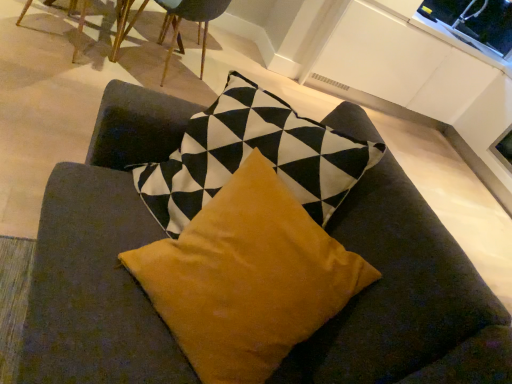
Locate an element on the screen. This screenshot has height=384, width=512. transparent glass window screen at upper right is located at coordinates (503, 148).

The image size is (512, 384). Identify the location of mustard velvet pillow at center. (247, 278).

How much space does wooden chair at upper center, marked as the 2th chair in a left-to-right arrangement, occupy vertically?

wooden chair at upper center, marked as the 2th chair in a left-to-right arrangement, is 26.41 inches tall.

I want to click on transparent glass window screen at upper right, so click(503, 148).

Who is taller, mustard velvet pillow at center or transparent glass window screen at upper right?

mustard velvet pillow at center.

Considering the positions of points (157, 273) and (508, 144), is point (157, 273) farther from camera compared to point (508, 144)?

No.

Is mustard velvet pillow at center spatially inside transparent glass window screen at upper right, or outside of it?

The correct answer is: outside.

At what (x,y) coordinates should I click in order to perform the action: click on pillow to the left of transparent glass window screen at upper right. Please return your answer as a coordinate pair (x, y). Looking at the image, I should click on (247, 278).

Which object is wider, transparent glass window screen at upper right or wooden chair at upper left, positioned as the 1th chair in left-to-right order?

Wider between the two is wooden chair at upper left, positioned as the 1th chair in left-to-right order.

Which of these two, transparent glass window screen at upper right or wooden chair at upper left, positioned as the 1th chair in left-to-right order, stands shorter?

transparent glass window screen at upper right.

Is transparent glass window screen at upper right oriented towards wooden chair at upper left, the second chair positioned from the right?

Yes, transparent glass window screen at upper right faces towards wooden chair at upper left, the second chair positioned from the right.

In the image, is wooden chair at upper center, the 1th chair in the right-to-left sequence, on the left side or the right side of transparent glass window screen at upper right?

wooden chair at upper center, the 1th chair in the right-to-left sequence, is to the left of transparent glass window screen at upper right.

Is wooden chair at upper center, marked as the 2th chair in a left-to-right arrangement, wider than transparent glass window screen at upper right?

Correct, the width of wooden chair at upper center, marked as the 2th chair in a left-to-right arrangement, exceeds that of transparent glass window screen at upper right.

From the picture: From the image's perspective, which one is positioned higher, wooden chair at upper center, marked as the 2th chair in a left-to-right arrangement, or transparent glass window screen at upper right?

wooden chair at upper center, marked as the 2th chair in a left-to-right arrangement, is shown above in the image.

Where is `the 1st chair below the transparent glass window screen at upper right (from a real-world perspective)`? the 1st chair below the transparent glass window screen at upper right (from a real-world perspective) is located at coordinates (188, 20).

From the image's perspective, which one is positioned higher, wooden chair at upper left, the second chair positioned from the right, or mustard velvet pillow at center?

wooden chair at upper left, the second chair positioned from the right, from the image's perspective.

In the scene shown: Choose the correct answer: Is wooden chair at upper left, the second chair positioned from the right, inside mustard velvet pillow at center or outside it?

wooden chair at upper left, the second chair positioned from the right, is located beyond the bounds of mustard velvet pillow at center.

I want to click on the 2nd chair directly beneath the mustard velvet pillow at center (from a real-world perspective), so click(x=121, y=19).

Between wooden chair at upper left, positioned as the 1th chair in left-to-right order, and mustard velvet pillow at center, which one has more height?

Standing taller between the two is mustard velvet pillow at center.

Which object is closer to the camera taking this photo, mustard velvet pillow at center or wooden chair at upper center, marked as the 2th chair in a left-to-right arrangement?

mustard velvet pillow at center is in front.

Considering the sizes of mustard velvet pillow at center and wooden chair at upper center, marked as the 2th chair in a left-to-right arrangement, in the image, is mustard velvet pillow at center wider or thinner than wooden chair at upper center, marked as the 2th chair in a left-to-right arrangement,?

Clearly, mustard velvet pillow at center has less width compared to wooden chair at upper center, marked as the 2th chair in a left-to-right arrangement.

Does point (152, 251) come in front of point (211, 13)?

Yes.

Looking at the image, does mustard velvet pillow at center seem bigger or smaller compared to wooden chair at upper center, marked as the 2th chair in a left-to-right arrangement?

In the image, mustard velvet pillow at center appears to be smaller than wooden chair at upper center, marked as the 2th chair in a left-to-right arrangement.

From the image's perspective, is mustard velvet pillow at center positioned above or below wooden chair at upper left, positioned as the 1th chair in left-to-right order?

Clearly, from the image's perspective, mustard velvet pillow at center is below wooden chair at upper left, positioned as the 1th chair in left-to-right order.

Where is `pillow that is on the right side of wooden chair at upper left, positioned as the 1th chair in left-to-right order`? Image resolution: width=512 pixels, height=384 pixels. pillow that is on the right side of wooden chair at upper left, positioned as the 1th chair in left-to-right order is located at coordinates (247, 278).

Which object is more forward, mustard velvet pillow at center or wooden chair at upper left, the second chair positioned from the right?

mustard velvet pillow at center.

Is wooden chair at upper left, positioned as the 1th chair in left-to-right order, positioned with its back to transparent glass window screen at upper right?

No, transparent glass window screen at upper right is not at the back of wooden chair at upper left, positioned as the 1th chair in left-to-right order.

Considering the relative positions of wooden chair at upper left, the second chair positioned from the right, and transparent glass window screen at upper right in the image provided, is wooden chair at upper left, the second chair positioned from the right, to the left or to the right of transparent glass window screen at upper right?

Clearly, wooden chair at upper left, the second chair positioned from the right, is on the left of transparent glass window screen at upper right in the image.

From a real-world perspective, is wooden chair at upper left, positioned as the 1th chair in left-to-right order, located higher than transparent glass window screen at upper right?

No, from a real-world perspective, wooden chair at upper left, positioned as the 1th chair in left-to-right order, is not over transparent glass window screen at upper right

Is point (127, 3) less distant than point (509, 132)?

Yes, point (127, 3) is in front of point (509, 132).

I want to click on window screen to the right of mustard velvet pillow at center, so click(x=503, y=148).

The image size is (512, 384). I want to click on the 1st chair above the transparent glass window screen at upper right (from the image's perspective), so click(x=121, y=19).

Looking at the image, which one is located closer to wooden chair at upper center, marked as the 2th chair in a left-to-right arrangement, wooden chair at upper left, the second chair positioned from the right, or transparent glass window screen at upper right?

Among the two, wooden chair at upper left, the second chair positioned from the right, is located nearer to wooden chair at upper center, marked as the 2th chair in a left-to-right arrangement.

Which object lies further to the anchor point wooden chair at upper center, marked as the 2th chair in a left-to-right arrangement, transparent glass window screen at upper right or mustard velvet pillow at center?

transparent glass window screen at upper right.

Looking at this image, which object lies nearer to the anchor point wooden chair at upper left, the second chair positioned from the right, mustard velvet pillow at center or wooden chair at upper center, marked as the 2th chair in a left-to-right arrangement?

The object closer to wooden chair at upper left, the second chair positioned from the right, is wooden chair at upper center, marked as the 2th chair in a left-to-right arrangement.

From the image, which object appears to be farther from wooden chair at upper center, marked as the 2th chair in a left-to-right arrangement, mustard velvet pillow at center or wooden chair at upper left, positioned as the 1th chair in left-to-right order?

mustard velvet pillow at center.

Considering their positions, is transparent glass window screen at upper right positioned further to wooden chair at upper left, the second chair positioned from the right, than mustard velvet pillow at center?

transparent glass window screen at upper right is further to wooden chair at upper left, the second chair positioned from the right.

Considering their positions, is wooden chair at upper center, the 1th chair in the right-to-left sequence, positioned closer to mustard velvet pillow at center than wooden chair at upper left, the second chair positioned from the right?

wooden chair at upper left, the second chair positioned from the right, lies closer to mustard velvet pillow at center than the other object.

Based on their spatial positions, is wooden chair at upper center, marked as the 2th chair in a left-to-right arrangement, or transparent glass window screen at upper right further from mustard velvet pillow at center?

transparent glass window screen at upper right is further to mustard velvet pillow at center.

Considering their positions, is wooden chair at upper center, marked as the 2th chair in a left-to-right arrangement, positioned further to transparent glass window screen at upper right than wooden chair at upper left, the second chair positioned from the right?

wooden chair at upper left, the second chair positioned from the right, is further to transparent glass window screen at upper right.

At what (x,y) coordinates should I click in order to perform the action: click on chair situated between wooden chair at upper left, the second chair positioned from the right, and transparent glass window screen at upper right from left to right. Please return your answer as a coordinate pair (x, y). Looking at the image, I should click on (188, 20).

Find the location of a particular element. The width and height of the screenshot is (512, 384). pillow between wooden chair at upper center, marked as the 2th chair in a left-to-right arrangement, and transparent glass window screen at upper right from left to right is located at coordinates (247, 278).

Where is `pillow located between wooden chair at upper left, the second chair positioned from the right, and transparent glass window screen at upper right in the left-right direction`? pillow located between wooden chair at upper left, the second chair positioned from the right, and transparent glass window screen at upper right in the left-right direction is located at coordinates (247, 278).

Locate an element on the screen. Image resolution: width=512 pixels, height=384 pixels. chair between mustard velvet pillow at center and wooden chair at upper center, marked as the 2th chair in a left-to-right arrangement, in the front-back direction is located at coordinates (121, 19).